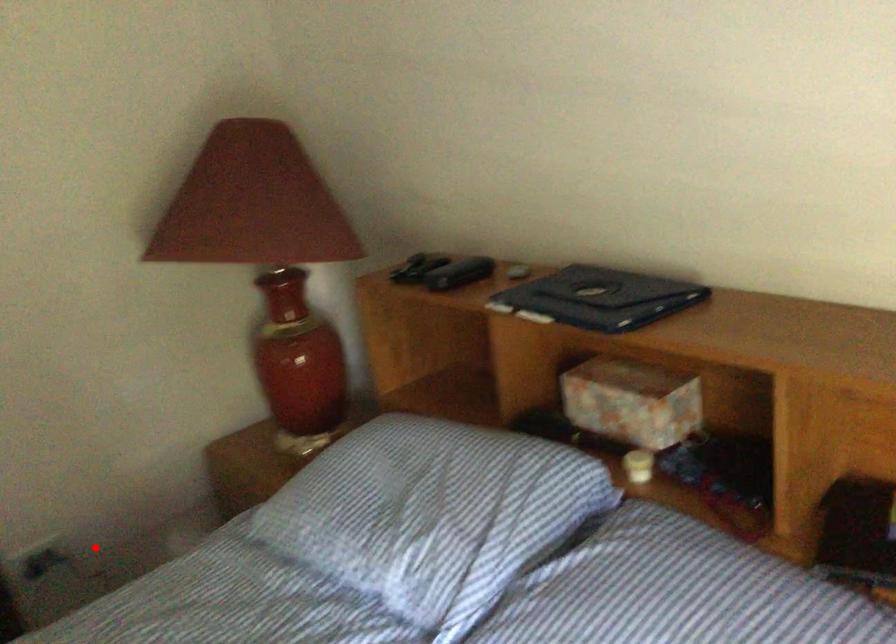
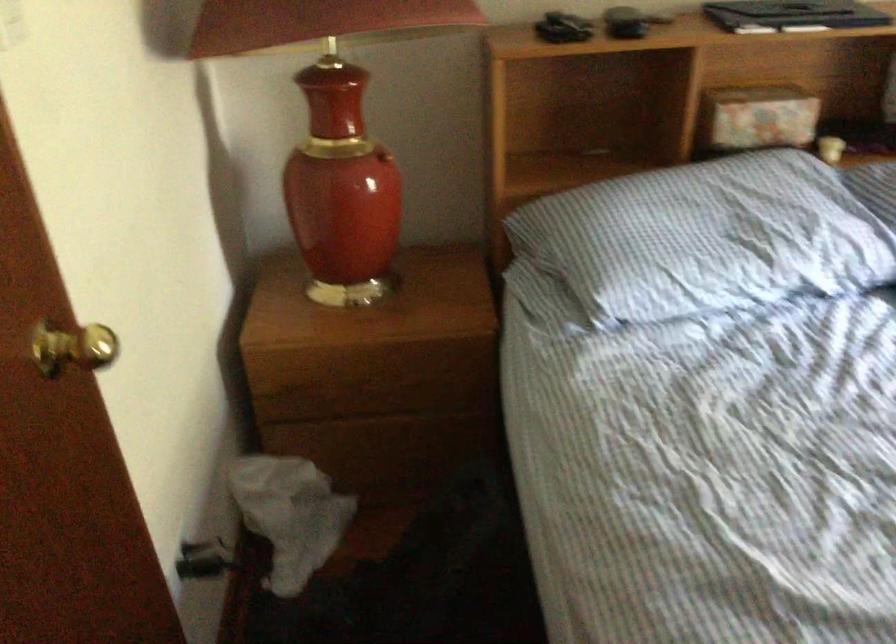
Question: I am providing you with two images of the same scene from different viewpoints. A red point is marked on the first image. At the location where the point appears in image 1, is it still visible in image 2?

Choices:
 (A) Yes
 (B) No

Answer: (A)